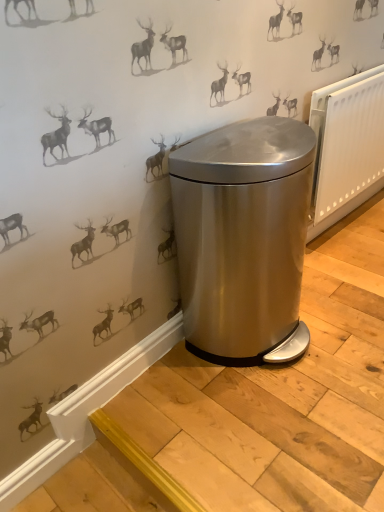
The height and width of the screenshot is (512, 384). I want to click on vacant region to the right of satin silver trash can at center, so click(x=345, y=321).